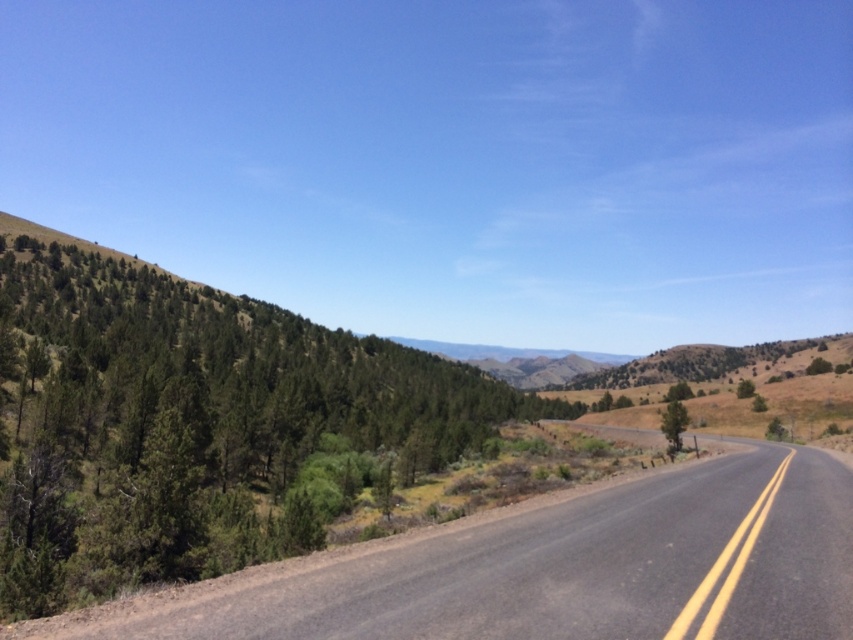
Question: Can you confirm if green leafy tree at left is wider than green matte tree at center-right?

Choices:
 (A) no
 (B) yes

Answer: (B)

Question: Can you confirm if black asphalt road at center is positioned to the right of green leafy tree at center-right?

Choices:
 (A) yes
 (B) no

Answer: (B)

Question: Which point is closer to the camera?

Choices:
 (A) (679, 448)
 (B) (564, 566)

Answer: (B)

Question: Which object is closer to the camera taking this photo?

Choices:
 (A) black asphalt road at center
 (B) green matte tree at center-right

Answer: (A)

Question: Is black asphalt road at center further to the viewer compared to green leafy tree at center-right?

Choices:
 (A) yes
 (B) no

Answer: (B)

Question: Which object is farther from the camera taking this photo?

Choices:
 (A) black asphalt road at center
 (B) green matte tree at center-right
 (C) green leafy tree at left
 (D) green leafy tree at center-right

Answer: (D)